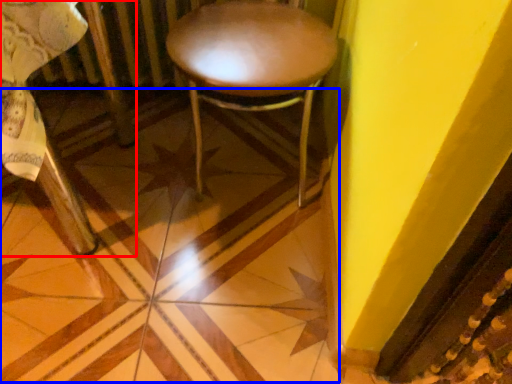
Question: Among these objects, which one is nearest to the camera, chair (highlighted by a red box) or tile (highlighted by a blue box)?

Choices:
 (A) chair
 (B) tile

Answer: (A)